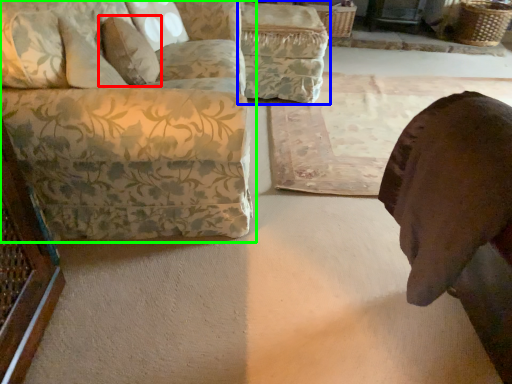
Question: Which object is positioned farthest from pillow (highlighted by a red box)? Select from swivel chair (highlighted by a blue box) and studio couch (highlighted by a green box).

Choices:
 (A) swivel chair
 (B) studio couch

Answer: (A)